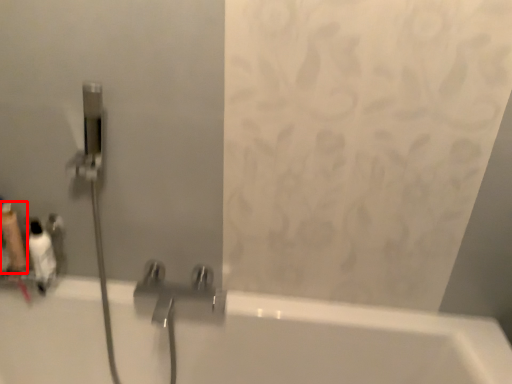
Question: Considering the relative positions of toiletry (annotated by the red box) and toiletry in the image provided, where is toiletry (annotated by the red box) located with respect to the staircase?

Choices:
 (A) left
 (B) right

Answer: (A)